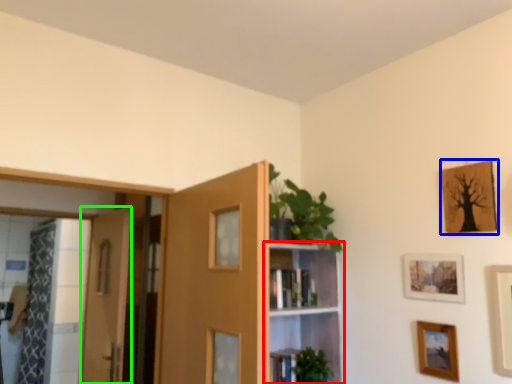
Question: Based on their relative distances, which object is farther from shelf (highlighted by a red box)? Choose from picture frame (highlighted by a blue box) and door (highlighted by a green box).

Choices:
 (A) picture frame
 (B) door

Answer: (B)